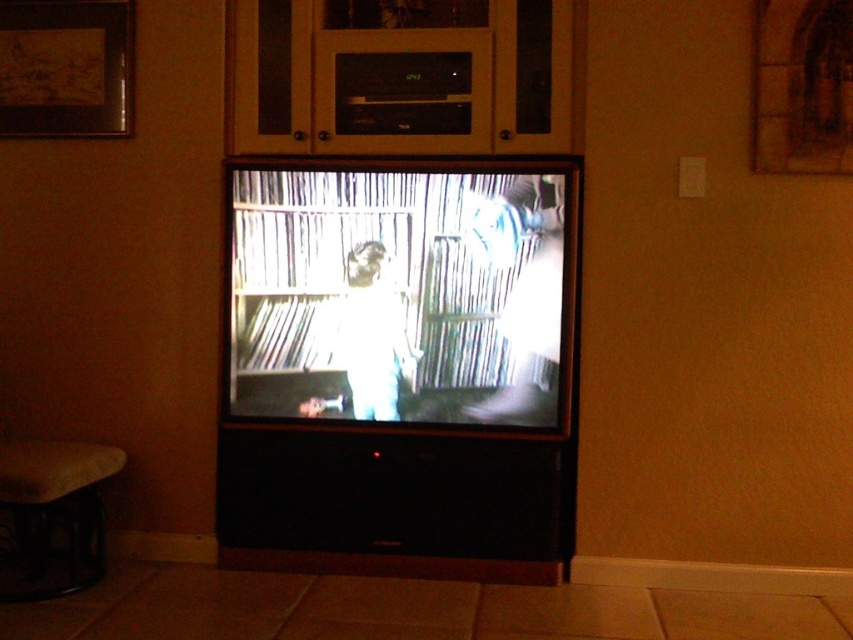
You are a guest in the living room and want to sit down to watch the TV. The smooth brown stool at lower left and the matte black flat screen tv at center are in your view. Which object should you approach to sit closer to the TV?

You should approach the smooth brown stool at lower left because it is behind the matte black flat screen tv at center, meaning it is positioned farther away from the TV. To sit closer to the TV, you would need to move towards the stool and then adjust your position forward.

You are a delivery person who just arrived at a house. You need to place a package that is 36 inches long on the floor between the black matte television at center and the smooth brown stool at lower left. Is there enough space to place the package horizontally without tilting it?

The distance between the black matte television at center and the smooth brown stool at lower left is 35.05 inches. Since the package is 36 inches long, it is slightly longer than the available space. Therefore, placing the package horizontally between them without tilting would not be possible due to insufficient space.

You need to place a new decorative item that is the same size as the smooth brown stool at lower left on the black matte television at center. Will it fit?

The black matte television at center is bigger than smooth brown stool at lower left, so the decorative item will fit since the television is larger than the stool.